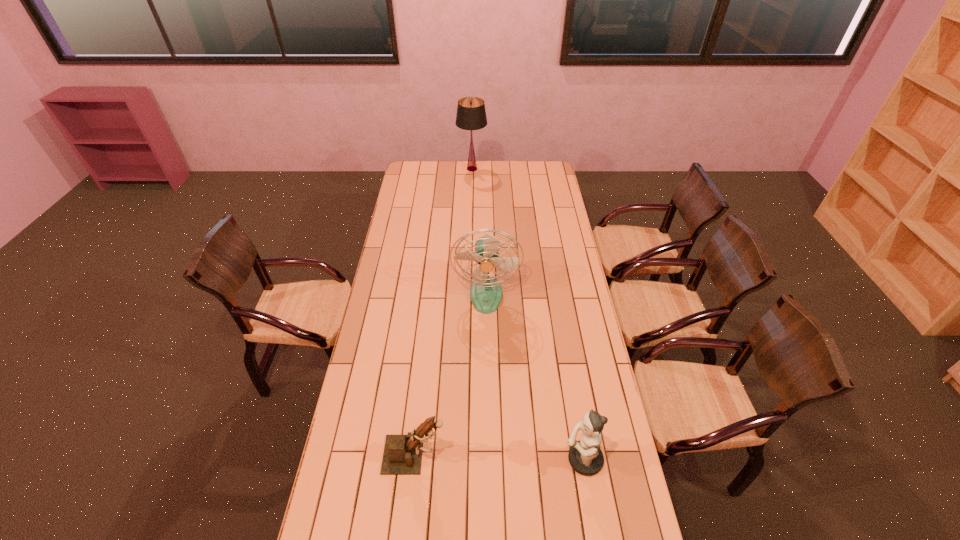
You are a GUI agent. You are given a task and a screenshot of the screen. Output one action in this format:
    pyautogui.click(x=<x>, y=<y>)
    Task: Click on the object at the far edge
    
    Given the screenshot: What is the action you would take?
    coord(471,115)

The image size is (960, 540). I want to click on object at the left edge, so click(x=402, y=455).

Where is `object at the right edge`? The width and height of the screenshot is (960, 540). object at the right edge is located at coordinates coord(585,456).

Locate an element on the screen. The image size is (960, 540). vacant space at the far edge is located at coordinates (498, 179).

In order to click on blank area at the left edge in this screenshot , I will do `click(412, 190)`.

Where is `free region at the right edge`? Image resolution: width=960 pixels, height=540 pixels. free region at the right edge is located at coordinates (599, 475).

Where is `free spot between the right figurine and the fan`? free spot between the right figurine and the fan is located at coordinates (535, 377).

Image resolution: width=960 pixels, height=540 pixels. Find the location of `free space between the left figurine and the rightmost object`. free space between the left figurine and the rightmost object is located at coordinates tap(499, 457).

I want to click on free spot between the left figurine and the third nearest object, so click(450, 374).

Where is `free space between the left figurine and the right figurine`? Image resolution: width=960 pixels, height=540 pixels. free space between the left figurine and the right figurine is located at coordinates (499, 457).